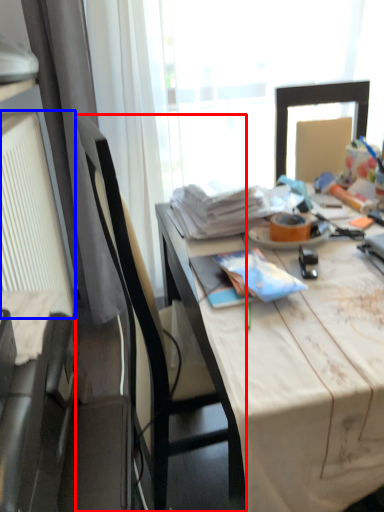
Question: Which object is closer to the camera taking this photo, chair (highlighted by a red box) or radiator (highlighted by a blue box)?

Choices:
 (A) chair
 (B) radiator

Answer: (A)